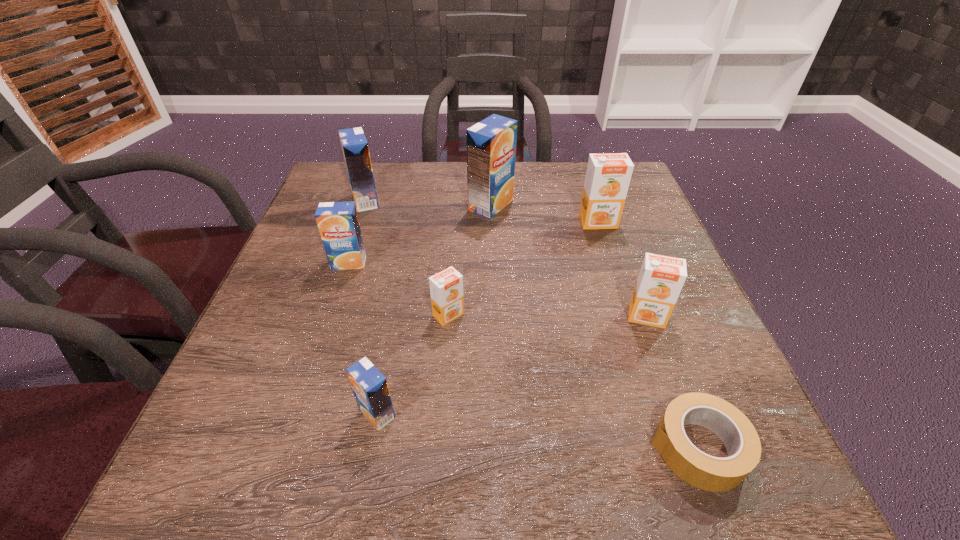
Locate an element on the screen. the leftmost orange orange juice is located at coordinates (446, 287).

Identify the location of duct tape. This screenshot has width=960, height=540. (703, 471).

This screenshot has height=540, width=960. I want to click on blank space located on the front of the fifth object from left to right, so click(492, 242).

Locate an element on the screen. The height and width of the screenshot is (540, 960). vacant space located 0.160m on the back of the second biggest blue orange_juice is located at coordinates coord(379,161).

Find the location of `blank area located on the left of the farthest orange orange juice`. blank area located on the left of the farthest orange orange juice is located at coordinates (482, 222).

The image size is (960, 540). What are the coordinates of `free region located on the front of the fourth farthest object` in the screenshot? It's located at (312, 375).

Identify the location of vacant point located on the back of the second smallest orange orange juice. point(634,281).

You are a GUI agent. You are given a task and a screenshot of the screen. Output one action in this format:
    pyautogui.click(x=<x>, y=<y>)
    Task: Click on the free space located on the right of the third object from left to right
    Image resolution: width=960 pixels, height=540 pixels.
    Given the screenshot: What is the action you would take?
    pyautogui.click(x=552, y=413)

You are a GUI agent. You are given a task and a screenshot of the screen. Output one action in this format:
    pyautogui.click(x=<x>, y=<y>)
    Task: Click on the vacant space located 0.100m on the left of the smallest orange orange juice
    
    Given the screenshot: What is the action you would take?
    pyautogui.click(x=381, y=315)

Locate an element on the screen. The width and height of the screenshot is (960, 540). blank area located 0.200m at the edge of the duct tape is located at coordinates (518, 448).